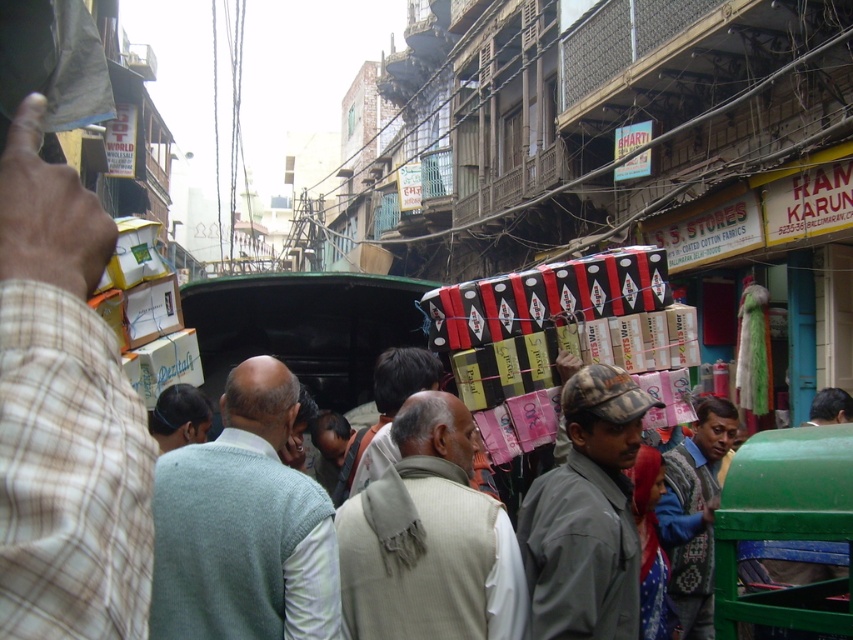
Does light gray sweater at center have a greater width compared to dark brown hair at center?

Yes, light gray sweater at center is wider than dark brown hair at center.

Describe the element at coordinates (242, 525) in the screenshot. I see `light gray sweater at center` at that location.

Between point (264, 637) and point (192, 426), which one is positioned behind?

Point (192, 426)

The height and width of the screenshot is (640, 853). I want to click on light gray sweater at center, so click(x=242, y=525).

Is beige woolen vest at center in front of knitted sweater at center?

Yes, it is.

Who is higher up, beige woolen vest at center or knitted sweater at center?

beige woolen vest at center is higher up.

Which is behind, point (468, 627) or point (705, 481)?

Positioned behind is point (705, 481).

At what (x,y) coordinates should I click in order to perform the action: click on beige woolen vest at center. Please return your answer as a coordinate pair (x, y). Looking at the image, I should click on (428, 540).

Can you confirm if light gray sweater at center is positioned below knitted sweater at center?

No.

Who is more distant from viewer, (206,556) or (682,564)?

The point (682,564) is more distant.

Which is behind, point (302, 476) or point (672, 589)?

Positioned behind is point (672, 589).

This screenshot has width=853, height=640. I want to click on light gray sweater at center, so click(x=242, y=525).